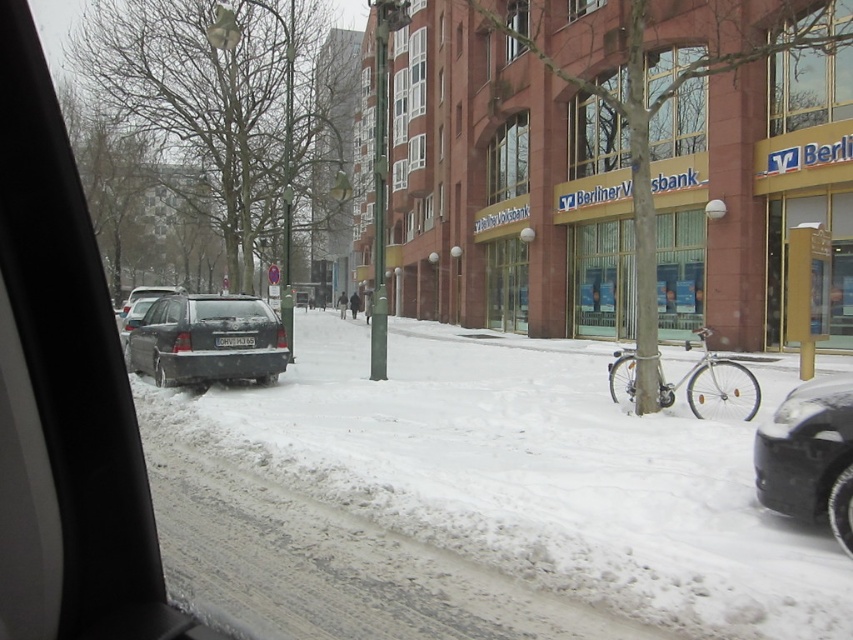
Question: From the image, what is the correct spatial relationship of black rubber car at lower right in relation to transparent glass window at center?

Choices:
 (A) below
 (B) above

Answer: (A)

Question: Which point appears closest to the camera in this image?

Choices:
 (A) (614, 358)
 (B) (161, 348)
 (C) (833, 22)
 (D) (494, 177)

Answer: (B)

Question: Can you confirm if silver metallic bicycle at lower right is wider than transparent glass window at center?

Choices:
 (A) no
 (B) yes

Answer: (B)

Question: Which of these objects is positioned farthest from the white powdery snow at center?

Choices:
 (A) transparent glass car window at upper right
 (B) silver metallic bicycle at lower right
 (C) transparent glass at upper center

Answer: (C)

Question: Which point is farther to the camera?

Choices:
 (A) silver metallic bicycle at lower right
 (B) black rubber car at lower right
 (C) satin black car at left

Answer: (C)

Question: Does black rubber car at lower right have a smaller size compared to transparent glass window at center?

Choices:
 (A) no
 (B) yes

Answer: (A)